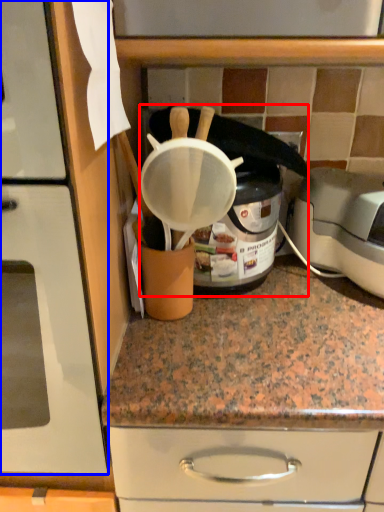
Question: Which object is closer to the camera taking this photo, appliance (highlighted by a red box) or home appliance (highlighted by a blue box)?

Choices:
 (A) appliance
 (B) home appliance

Answer: (B)